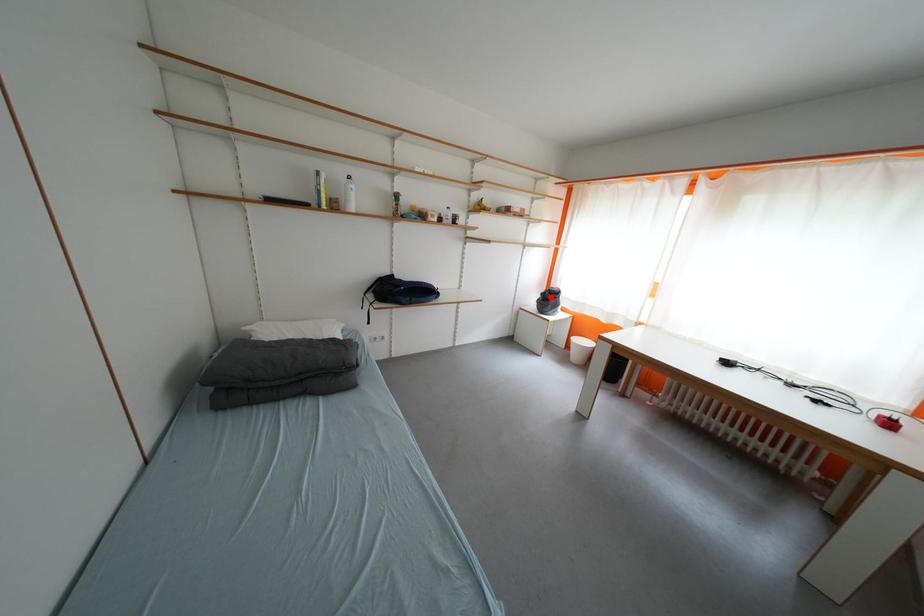
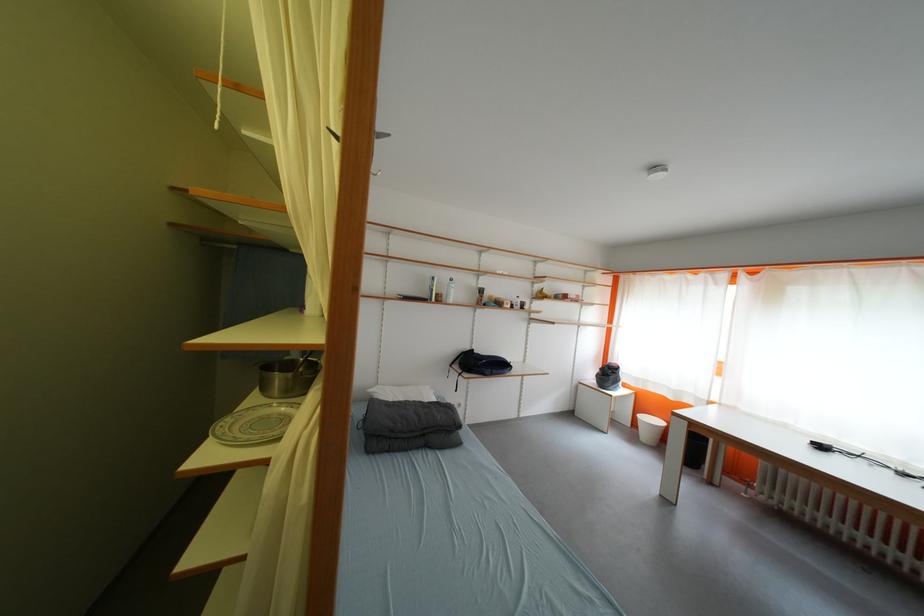
Locate, in the second image, the point that corresponds to the highlighted location in the first image.

(610, 371)